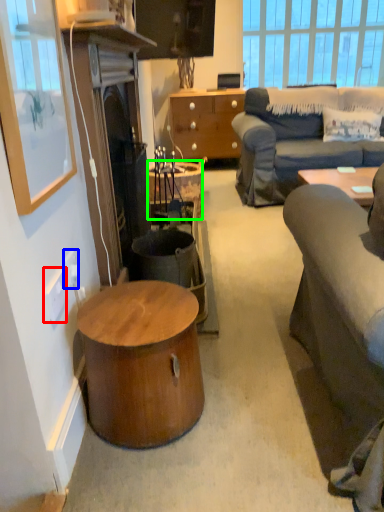
Question: Based on their relative distances, which object is nearer to power outlet (highlighted by a red box)? Choose from power outlet (highlighted by a blue box) and desk (highlighted by a green box).

Choices:
 (A) power outlet
 (B) desk

Answer: (A)